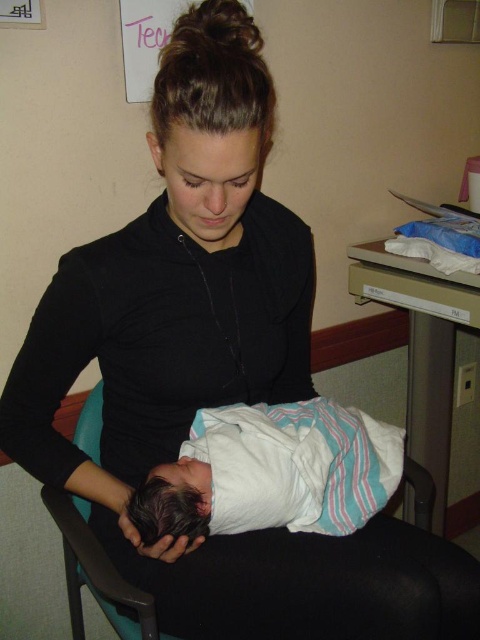
Who is lower down, white striped swaddle at center or black fabric chair at lower center?

Positioned lower is black fabric chair at lower center.

Is white striped swaddle at center in front of black fabric chair at lower center?

Yes, white striped swaddle at center is closer to the viewer.

At what (x,y) coordinates should I click in order to perform the action: click on white striped swaddle at center. Please return your answer as a coordinate pair (x, y). Looking at the image, I should click on (273, 472).

Where is `white striped swaddle at center`? white striped swaddle at center is located at coordinates (273, 472).